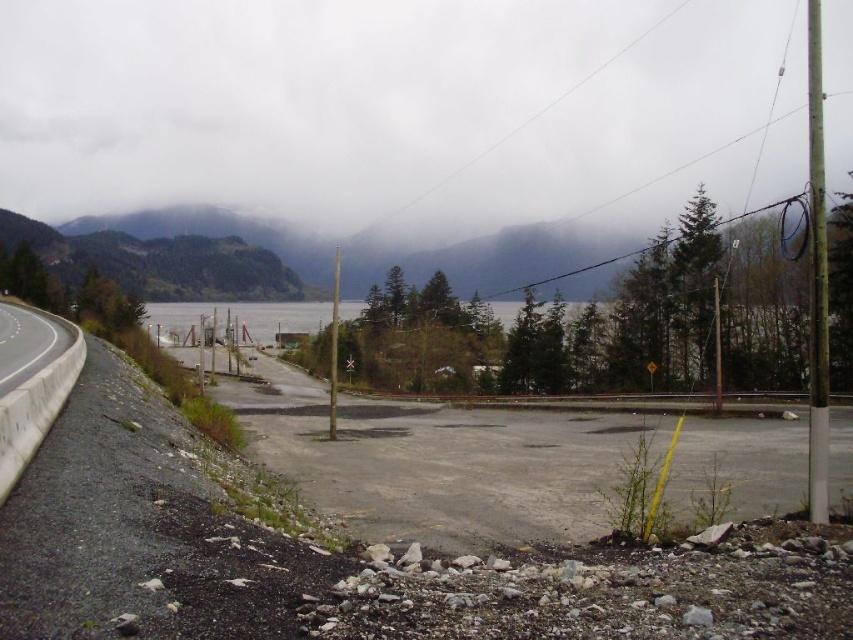
You are a hiker who has just arrived at the lakeside area. You notice a point marked at coordinates [384,108] in the image. Based on the scene description, what does this point most likely represent?

The point at [384,108] indicates cloudy fog at upper center.

You are driving along the road and notice the cloudy fog at upper center and the white concrete barrier at left. Which object is positioned to the right side of the other?

The cloudy fog at upper center is to the right of the white concrete barrier at left.

You are driving along the road and notice the cloudy fog at upper center and the white concrete barrier at left. Which of these two objects appears larger in the scene?

The cloudy fog at upper center appears larger than the white concrete barrier at left.